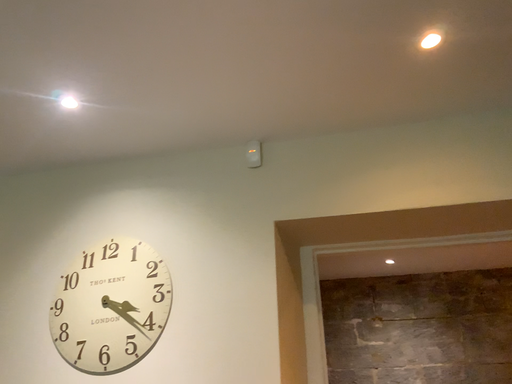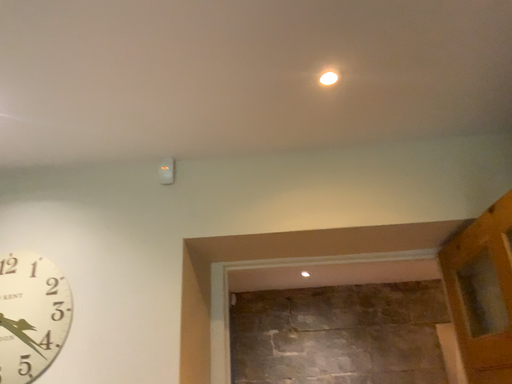
Question: How did the camera likely rotate when shooting the video?

Choices:
 (A) rotated right
 (B) rotated left

Answer: (A)